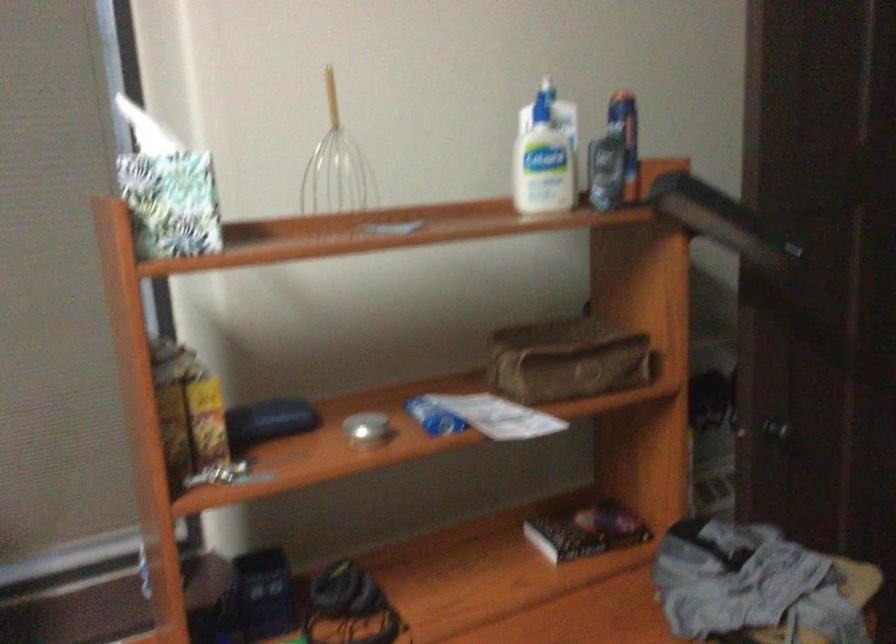
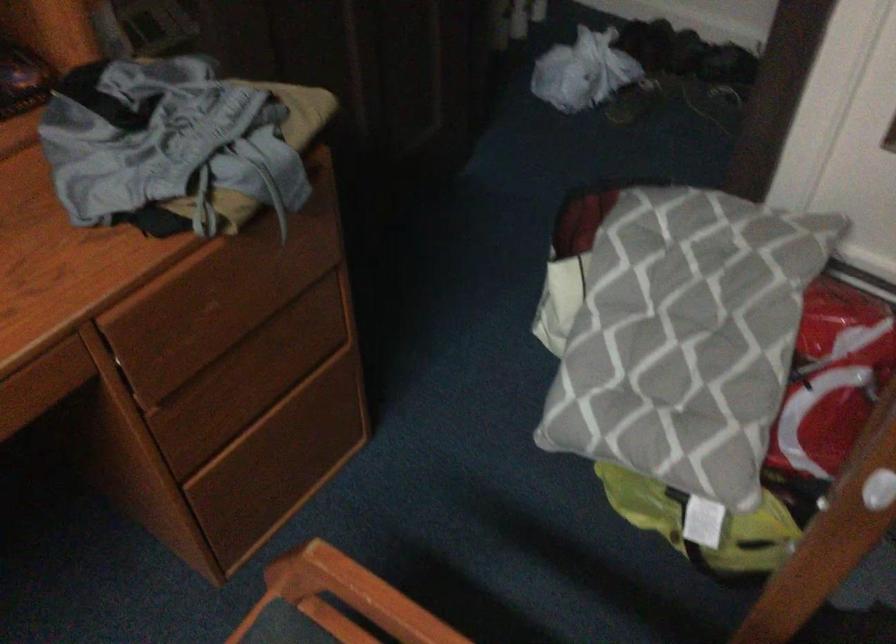
The images are taken continuously from a first-person perspective. In which direction is your viewpoint rotating?

The camera's rotation is toward right-down.